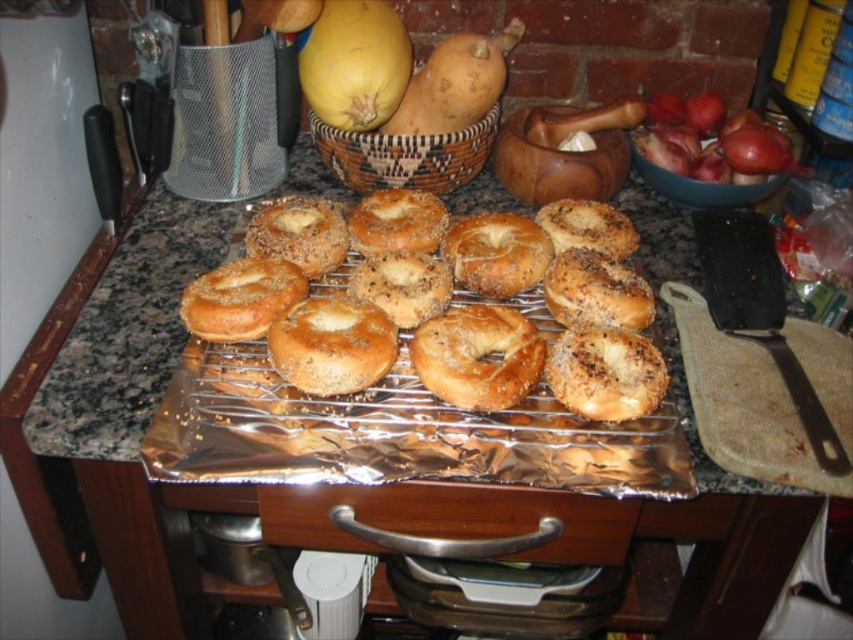
Is point (360, 33) farther from viewer compared to point (335, 163)?

No, it is in front of (335, 163).

Is yellow matte squash at upper center above woven brown basket at upper center?

Yes.

Measure the distance between point (308, 54) and camera.

Point (308, 54) is 37.91 inches away from camera.

This screenshot has width=853, height=640. What are the coordinates of `yellow matte squash at upper center` in the screenshot? It's located at coord(354,64).

Who is more forward, (277, 212) or (415, 141)?

Positioned in front is point (277, 212).

Is point (349, 276) more distant than point (430, 164)?

No, (349, 276) is in front of (430, 164).

Describe the element at coordinates (433, 317) in the screenshot. I see `golden brown bagel at center` at that location.

Locate an element on the screen. Image resolution: width=853 pixels, height=640 pixels. golden brown bagel at center is located at coordinates (433, 317).

Can you confirm if golden brown bagel at center is smaller than brown textured bagel at center?

Incorrect, golden brown bagel at center is not smaller in size than brown textured bagel at center.

This screenshot has height=640, width=853. I want to click on golden brown bagel at center, so click(433, 317).

Which is behind, point (483, 234) or point (448, 360)?

Positioned behind is point (483, 234).

In order to click on golden brown bagel at center in this screenshot , I will do `click(433, 317)`.